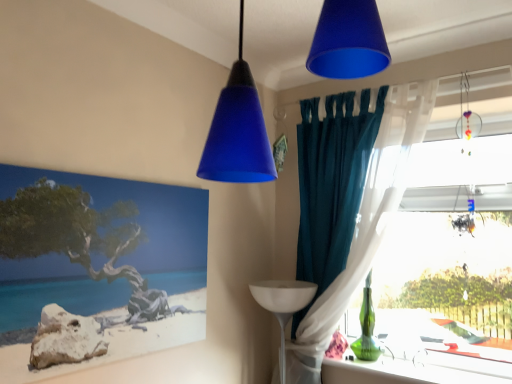
Question: Would you say teal fabric curtain at right is to the left or to the right of white glossy table lamp at lower right in the picture?

Choices:
 (A) right
 (B) left

Answer: (A)

Question: In terms of size, does teal fabric curtain at right appear bigger or smaller than white glossy table lamp at lower right?

Choices:
 (A) small
 (B) big

Answer: (B)

Question: Estimate the real-world distances between objects in this image. Which object is farther from the transparent glass table at right?

Choices:
 (A) teal fabric curtain at right
 (B) white glossy table lamp at lower right
 (C) translucent glass ornament at upper right, the 2th lamp viewed from the front
 (D) matte blue cone at upper center, acting as the second lamp starting from the back
 (E) matte canvas painting at left

Answer: (D)

Question: Which is nearer to the matte blue cone at upper center, which is the 1th lamp from left to right?

Choices:
 (A) transparent glass table at right
 (B) teal fabric curtain at right
 (C) matte canvas painting at left
 (D) white glossy table lamp at lower right
 (E) green glass bottle at lower right

Answer: (C)